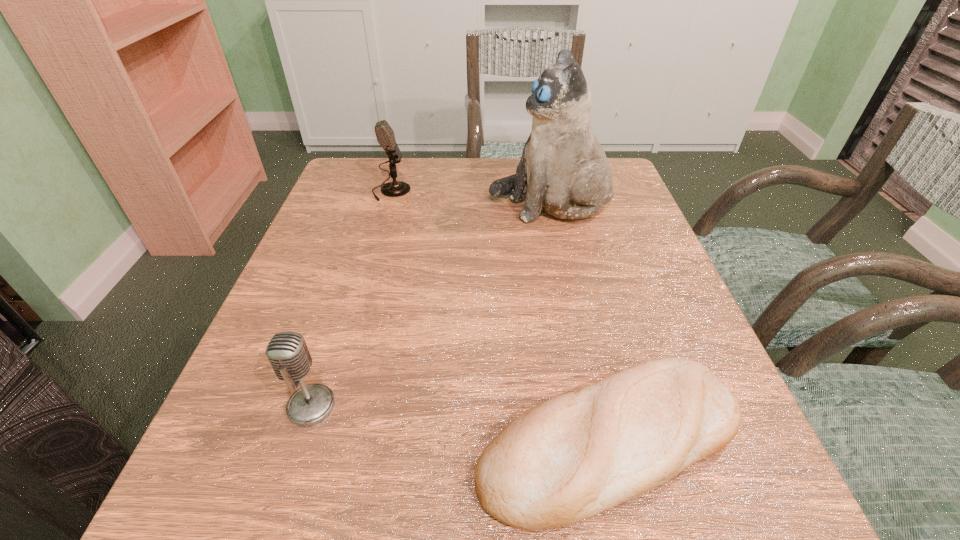
The width and height of the screenshot is (960, 540). What are the coordinates of `cat` in the screenshot? It's located at click(x=563, y=169).

At what (x,y) coordinates should I click in order to perform the action: click on the farther microphone. Please return your answer as a coordinate pair (x, y). The image size is (960, 540). Looking at the image, I should click on (385, 136).

Where is `the nearer microphone`? This screenshot has height=540, width=960. the nearer microphone is located at coordinates (287, 351).

Locate an element on the screen. The height and width of the screenshot is (540, 960). the shorter microphone is located at coordinates (287, 351).

This screenshot has width=960, height=540. I want to click on bread, so click(x=569, y=458).

Find the location of a particular element. The image size is (960, 540). vacant area situated 0.310m at the face of the cat is located at coordinates (361, 204).

Where is `free space located 0.250m at the face of the cat`? The width and height of the screenshot is (960, 540). free space located 0.250m at the face of the cat is located at coordinates (386, 204).

Identify the location of vacant space located 0.200m at the face of the cat. The width and height of the screenshot is (960, 540). (406, 204).

You are a GUI agent. You are given a task and a screenshot of the screen. Output one action in this format:
    pyautogui.click(x=<x>, y=<y>)
    Task: Click on the vacant space situated on the front-facing side of the farther microphone
    
    Given the screenshot: What is the action you would take?
    pyautogui.click(x=520, y=191)

Locate an element on the screen. The height and width of the screenshot is (540, 960). vacant area located 0.060m on the right of the nearer microphone is located at coordinates coord(374,406).